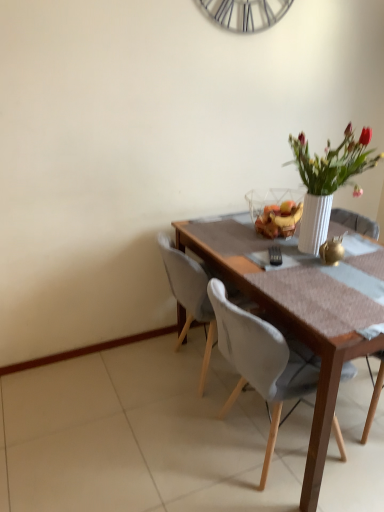
Question: Is white fabric chair at center, which ranks as the 2th chair in left-to-right order, turned away from wooden chair at right, which is the 1th chair in right-to-left order?

Choices:
 (A) no
 (B) yes

Answer: (A)

Question: Does white fabric chair at center, which ranks as the 2th chair in left-to-right order, turn towards wooden chair at right, which is the 1th chair in right-to-left order?

Choices:
 (A) no
 (B) yes

Answer: (B)

Question: From the image's perspective, does white fabric chair at center, which ranks as the 2th chair in left-to-right order, appear lower than wooden chair at right, which is the 1th chair in right-to-left order?

Choices:
 (A) no
 (B) yes

Answer: (B)

Question: From the image's perspective, is white fabric chair at center, which is counted as the second chair, starting from the right, located above wooden chair at right, which is the 1th chair in right-to-left order?

Choices:
 (A) yes
 (B) no

Answer: (B)

Question: Considering the relative positions of white fabric chair at center, which is counted as the second chair, starting from the right, and wooden chair at right, positioned as the third chair in left-to-right order, in the image provided, is white fabric chair at center, which is counted as the second chair, starting from the right, to the left of wooden chair at right, positioned as the third chair in left-to-right order, from the viewer's perspective?

Choices:
 (A) no
 (B) yes

Answer: (B)

Question: Is white fabric chair at center, which ranks as the 2th chair in left-to-right order, placed right next to wooden chair at right, which is the 1th chair in right-to-left order?

Choices:
 (A) no
 (B) yes

Answer: (A)

Question: Is white fabric chair at center, which is counted as the third chair, starting from the right, oriented towards white fabric chair at center, which ranks as the 2th chair in left-to-right order?

Choices:
 (A) no
 (B) yes

Answer: (A)

Question: Is white fabric chair at center, acting as the 1th chair starting from the left, shorter than white fabric chair at center, which ranks as the 2th chair in left-to-right order?

Choices:
 (A) yes
 (B) no

Answer: (A)

Question: Can you confirm if white fabric chair at center, acting as the 1th chair starting from the left, is positioned to the left of white fabric chair at center, which ranks as the 2th chair in left-to-right order?

Choices:
 (A) yes
 (B) no

Answer: (A)

Question: Is white fabric chair at center, acting as the 1th chair starting from the left, outside of white fabric chair at center, which ranks as the 2th chair in left-to-right order?

Choices:
 (A) no
 (B) yes

Answer: (B)

Question: Does white fabric chair at center, acting as the 1th chair starting from the left, have a greater height compared to white fabric chair at center, which ranks as the 2th chair in left-to-right order?

Choices:
 (A) no
 (B) yes

Answer: (A)

Question: Is white fabric chair at center, which is counted as the third chair, starting from the right, facing away from white fabric chair at center, which is counted as the second chair, starting from the right?

Choices:
 (A) no
 (B) yes

Answer: (A)

Question: Does wooden chair at right, positioned as the third chair in left-to-right order, have a greater height compared to white fabric chair at center, which is counted as the third chair, starting from the right?

Choices:
 (A) yes
 (B) no

Answer: (B)